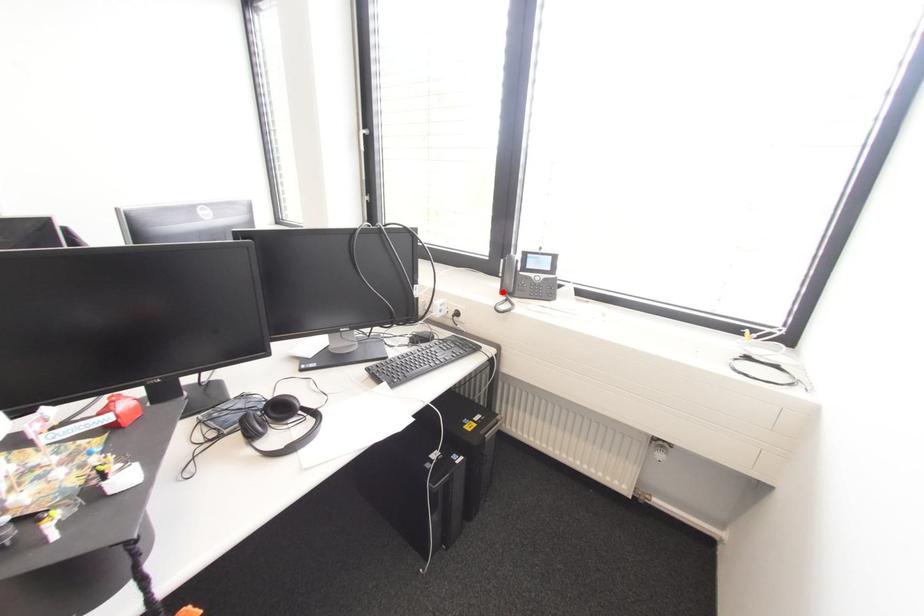
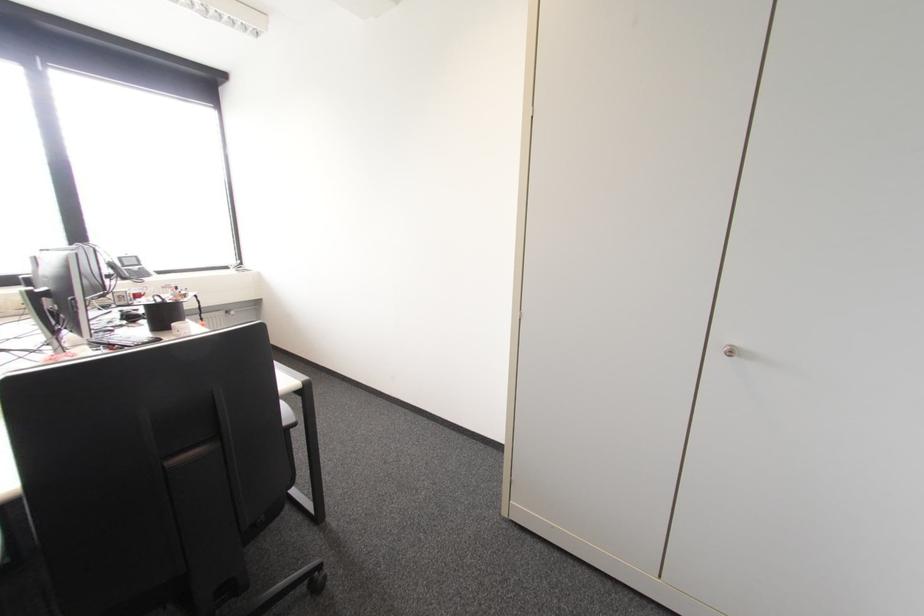
Locate, in the second image, the point that corresponds to the highlighted location in the first image.

(123, 278)